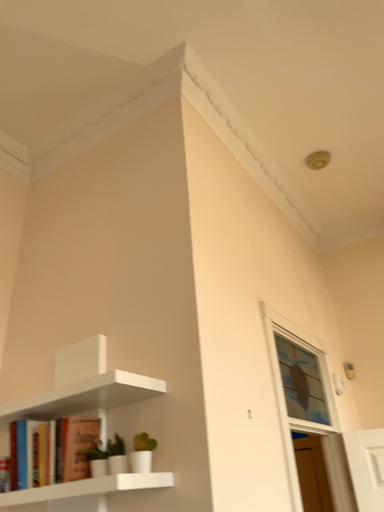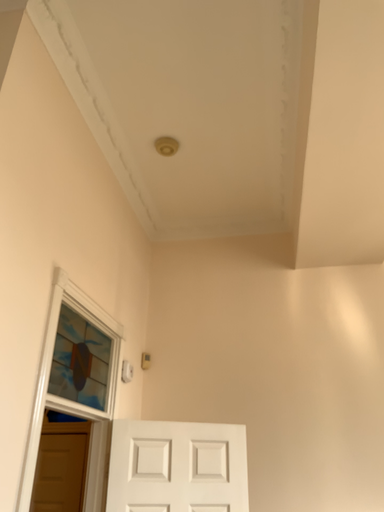
Question: How did the camera likely rotate when shooting the video?

Choices:
 (A) rotated right
 (B) rotated left

Answer: (A)